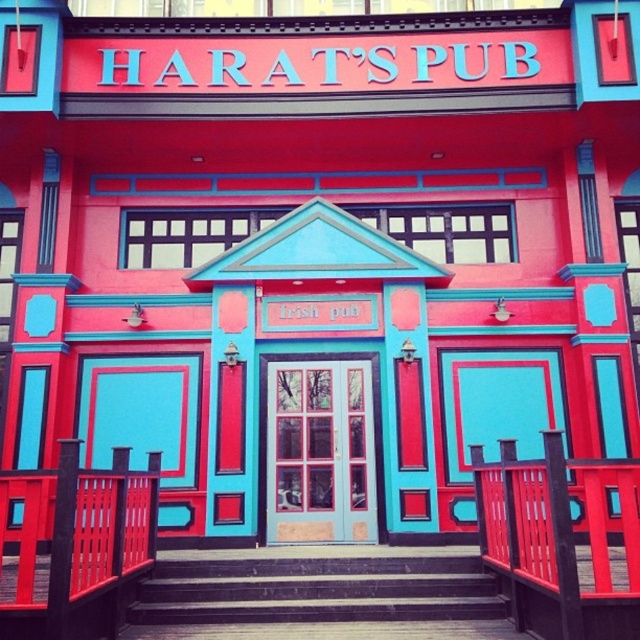
Is dark gray concrete stairs at center positioned before matte teal door at center?

Yes, dark gray concrete stairs at center is closer to the viewer.

Is point (252, 579) closer to camera compared to point (276, 486)?

That is True.

Locate an element on the screen. This screenshot has width=640, height=640. dark gray concrete stairs at center is located at coordinates (317, 586).

Consider the image. Is wooden textured rail at center shorter than matte teal door at center?

Yes.

Where is `wooden textured rail at center`? Image resolution: width=640 pixels, height=640 pixels. wooden textured rail at center is located at coordinates (561, 540).

Who is more forward, [544,460] or [282,410]?

Point [544,460]

Where is `wooden textured rail at center`? The height and width of the screenshot is (640, 640). wooden textured rail at center is located at coordinates (561, 540).

Does wooden textured rail at center lie behind dark gray concrete stairs at center?

No, it is in front of dark gray concrete stairs at center.

Who is more distant from viewer, (x=529, y=600) or (x=314, y=598)?

Positioned behind is point (x=314, y=598).

Where is `wooden textured rail at center`? This screenshot has height=640, width=640. wooden textured rail at center is located at coordinates (561, 540).